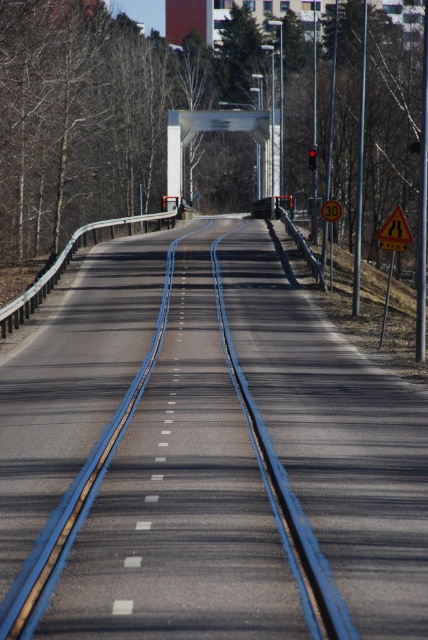
Consider the image. Can you confirm if brown leafless tree at center is positioned to the right of yellow reflective triangle at center?

No, brown leafless tree at center is not to the right of yellow reflective triangle at center.

Is point (380, 205) closer to camera compared to point (403, 230)?

No.

Where is `brown leafless tree at center`? The height and width of the screenshot is (640, 428). brown leafless tree at center is located at coordinates [97, 113].

Which is above, yellow reflective triangle at center or yellow reflective plastic speed limit sign at center?

yellow reflective plastic speed limit sign at center is above.

Is point (395, 218) closer to camera compared to point (335, 205)?

Yes.

Which is in front, point (397, 205) or point (332, 205)?

Point (332, 205) is in front.

You are a GUI agent. You are given a task and a screenshot of the screen. Output one action in this format:
    pyautogui.click(x=<x>, y=<y>)
    Task: Click on the yellow reflective triangle at center
    
    Given the screenshot: What is the action you would take?
    pyautogui.click(x=395, y=228)

Which is more to the left, brown leafless tree at center or yellow reflective plastic speed limit sign at center?

brown leafless tree at center

Does brown leafless tree at center appear on the right side of yellow reflective plastic speed limit sign at center?

In fact, brown leafless tree at center is to the left of yellow reflective plastic speed limit sign at center.

Image resolution: width=428 pixels, height=640 pixels. Find the location of `brown leafless tree at center`. brown leafless tree at center is located at coordinates (97, 113).